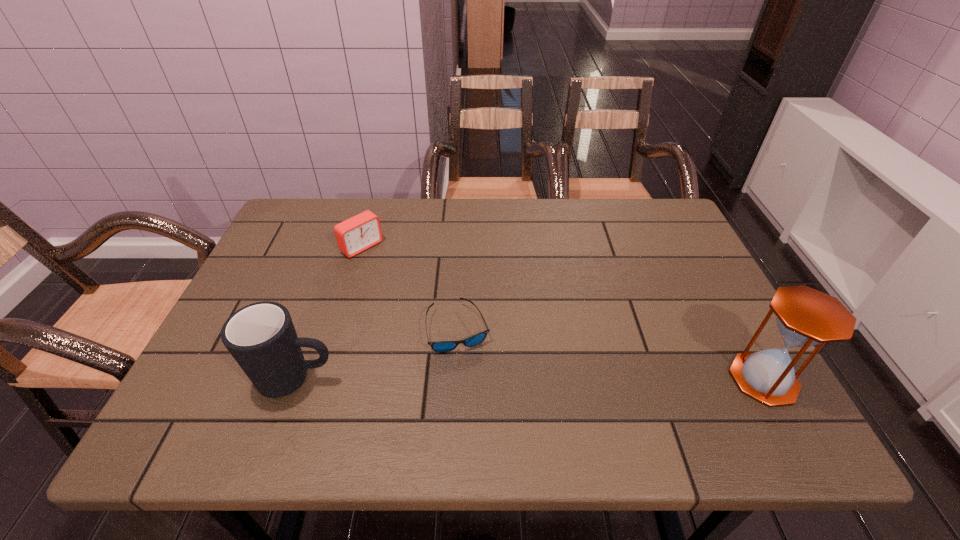
In order to click on object positioned at the near left corner in this screenshot , I will do `click(261, 337)`.

Find the location of a particular element. Image resolution: width=960 pixels, height=540 pixels. object present at the near right corner is located at coordinates (806, 317).

The width and height of the screenshot is (960, 540). What are the coordinates of `free point at the far edge` in the screenshot? It's located at (569, 230).

Identify the location of vacant space at the near edge of the desktop. (406, 402).

This screenshot has width=960, height=540. What are the coordinates of `free space at the left edge of the desktop` in the screenshot? It's located at (252, 283).

The image size is (960, 540). I want to click on vacant space at the right edge of the desktop, so click(x=679, y=280).

In the image, there is a desktop. Where is `free space at the far left corner`? Image resolution: width=960 pixels, height=540 pixels. free space at the far left corner is located at coordinates (322, 219).

Identify the location of free region at the far right corner. (654, 244).

Where is `vacant space that is in between the sunglasses and the alarm clock`? vacant space that is in between the sunglasses and the alarm clock is located at coordinates (410, 288).

Identify the location of vacant point located between the farthest object and the third shortest object. (329, 313).